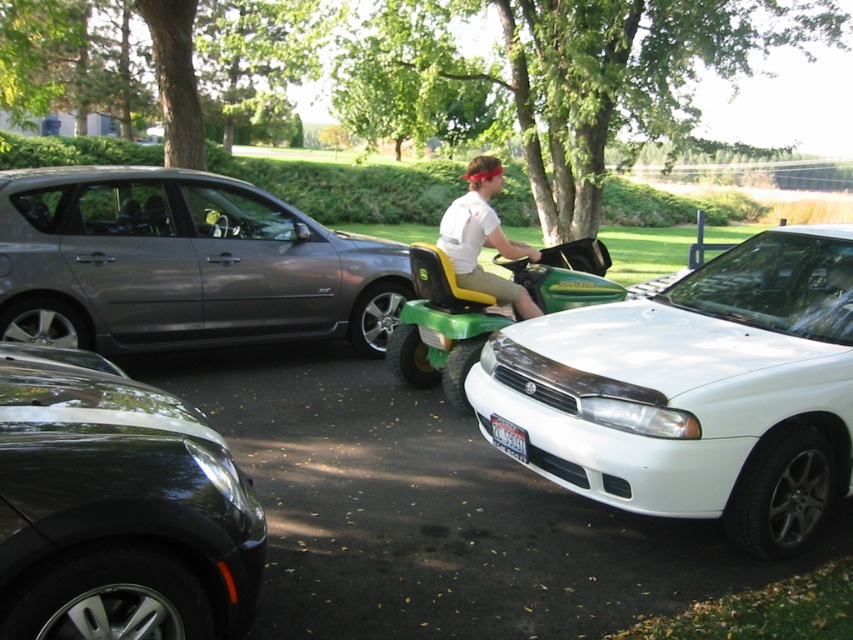
How distant is metallic gray hatchback at left from white matte shirt at center?

A distance of 2.01 meters exists between metallic gray hatchback at left and white matte shirt at center.

Can you confirm if metallic gray hatchback at left is positioned to the right of white matte shirt at center?

In fact, metallic gray hatchback at left is to the left of white matte shirt at center.

What do you see at coordinates (183, 262) in the screenshot?
I see `metallic gray hatchback at left` at bounding box center [183, 262].

This screenshot has height=640, width=853. What are the coordinates of `metallic gray hatchback at left` in the screenshot? It's located at (183, 262).

Between white matte shirt at center and white plastic license plate at lower center, which one is positioned lower?

white plastic license plate at lower center is below.

Between white matte shirt at center and white plastic license plate at lower center, which one appears on the right side from the viewer's perspective?

Positioned to the right is white matte shirt at center.

Does point (468, 177) come in front of point (520, 435)?

No, (468, 177) is further to viewer.

You are a GUI agent. You are given a task and a screenshot of the screen. Output one action in this format:
    pyautogui.click(x=<x>, y=<y>)
    Task: Click on the white matte shirt at center
    The width and height of the screenshot is (853, 640).
    Given the screenshot: What is the action you would take?
    pyautogui.click(x=483, y=237)

Does glossy black car at lower left have a greater width compared to white plastic license plate at lower center?

Indeed, glossy black car at lower left has a greater width compared to white plastic license plate at lower center.

This screenshot has height=640, width=853. I want to click on glossy black car at lower left, so click(x=117, y=508).

Where is `glossy black car at lower left`? glossy black car at lower left is located at coordinates (117, 508).